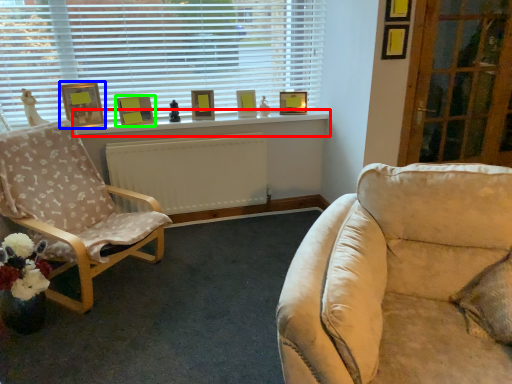
Question: Estimate the real-world distances between objects in this image. Which object is closer to window sill (highlighted by a red box), picture frame (highlighted by a blue box) or picture frame (highlighted by a green box)?

Choices:
 (A) picture frame
 (B) picture frame

Answer: (B)